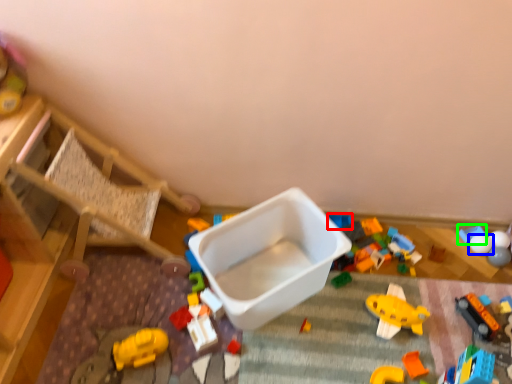
Question: Which object is the farthest from toy (highlighted by a red box)? Choose among these: toy (highlighted by a blue box) or toy (highlighted by a green box).

Choices:
 (A) toy
 (B) toy

Answer: (A)